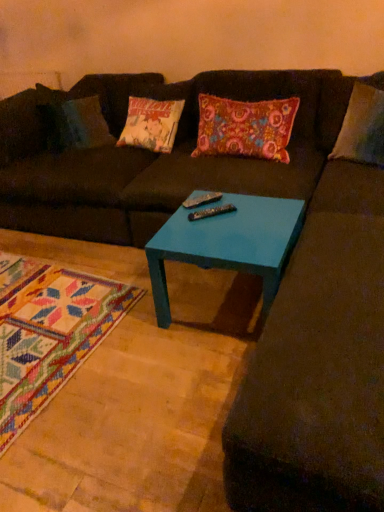
Locate an element on the screen. The width and height of the screenshot is (384, 512). vacant space to the right of metallic silver remote at center, which appears as the 2th remote when viewed from the front is located at coordinates (241, 205).